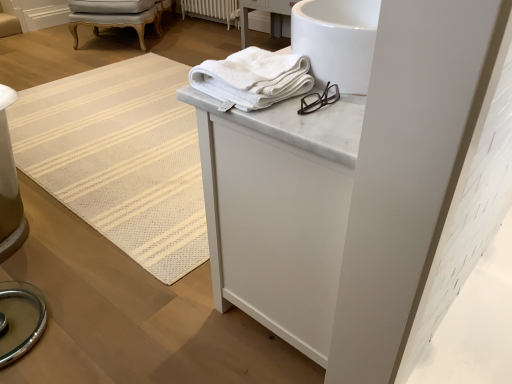
The width and height of the screenshot is (512, 384). I want to click on vacant area on top of white cotton towel at upper center (from a real-world perspective), so click(x=259, y=59).